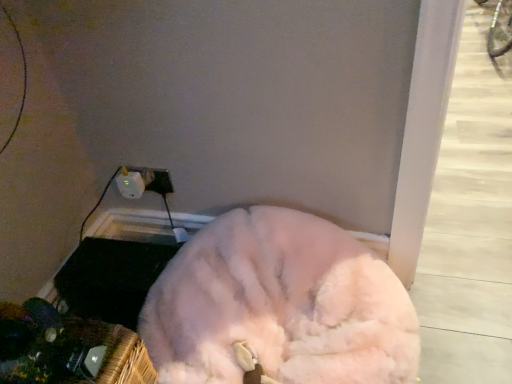
Question: Does fluffy white dog at lower center appear on the left side of white plastic electric outlet at lower left?

Choices:
 (A) yes
 (B) no

Answer: (B)

Question: Would you say fluffy white dog at lower center is outside white plastic electric outlet at lower left?

Choices:
 (A) no
 (B) yes

Answer: (B)

Question: From a real-world perspective, is fluffy white dog at lower center over white plastic electric outlet at lower left?

Choices:
 (A) yes
 (B) no

Answer: (B)

Question: Considering the relative sizes of fluffy white dog at lower center and white plastic electric outlet at lower left in the image provided, is fluffy white dog at lower center shorter than white plastic electric outlet at lower left?

Choices:
 (A) no
 (B) yes

Answer: (A)

Question: From a real-world perspective, is fluffy white dog at lower center located beneath white plastic electric outlet at lower left?

Choices:
 (A) no
 (B) yes

Answer: (B)

Question: Is fluffy white dog at lower center looking in the opposite direction of white plastic electric outlet at lower left?

Choices:
 (A) yes
 (B) no

Answer: (B)

Question: Considering the relative sizes of white plastic electric outlet at lower left and fluffy white dog at lower center in the image provided, is white plastic electric outlet at lower left taller than fluffy white dog at lower center?

Choices:
 (A) no
 (B) yes

Answer: (A)

Question: Is white plastic electric outlet at lower left positioned in front of fluffy white dog at lower center?

Choices:
 (A) yes
 (B) no

Answer: (B)

Question: Are white plastic electric outlet at lower left and fluffy white dog at lower center located far from each other?

Choices:
 (A) yes
 (B) no

Answer: (B)

Question: From a real-world perspective, is white plastic electric outlet at lower left under fluffy white dog at lower center?

Choices:
 (A) yes
 (B) no

Answer: (B)

Question: Is white plastic electric outlet at lower left positioned beyond the bounds of fluffy white dog at lower center?

Choices:
 (A) yes
 (B) no

Answer: (A)

Question: Is white plastic electric outlet at lower left shorter than fluffy white dog at lower center?

Choices:
 (A) no
 (B) yes

Answer: (B)

Question: From a real-world perspective, is fluffy white dog at lower center above or below white plastic electric outlet at lower left?

Choices:
 (A) above
 (B) below

Answer: (B)